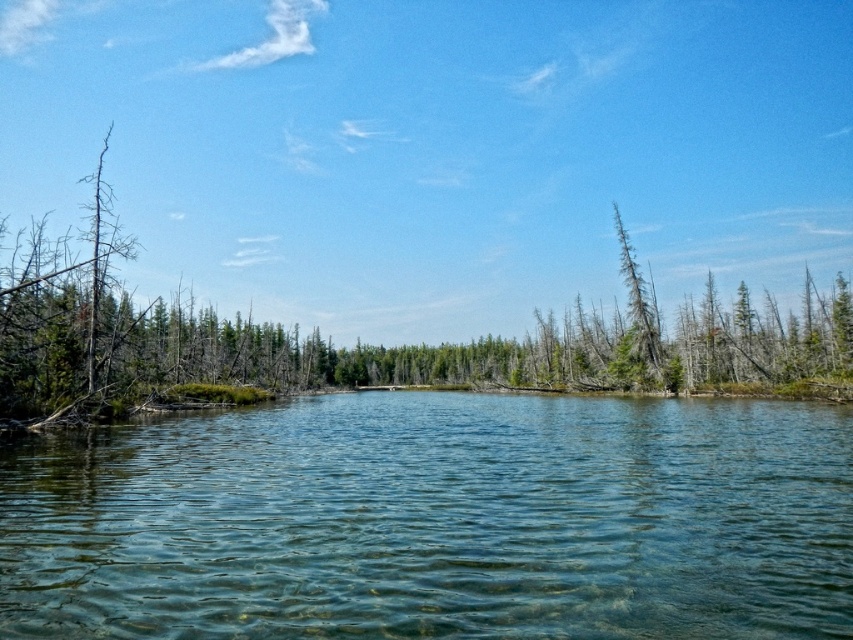
Is clear water at center to the right of green textured tree at center-right from the viewer's perspective?

In fact, clear water at center is to the left of green textured tree at center-right.

Is clear water at center above green textured tree at center-right?

No.

Locate an element on the screen. This screenshot has width=853, height=640. clear water at center is located at coordinates (436, 520).

How distant is clear water at center from green matte tree at center?

A distance of 45.09 meters exists between clear water at center and green matte tree at center.

Does point (439, 404) come in front of point (849, 346)?

No, (439, 404) is behind (849, 346).

Find the location of a particular element. The height and width of the screenshot is (640, 853). clear water at center is located at coordinates (436, 520).

How far apart are green matte tree at center and green textured tree at center-right?

They are 172.33 feet apart.

Is green matte tree at center to the left of green textured tree at center-right from the viewer's perspective?

Yes, green matte tree at center is to the left of green textured tree at center-right.

At what (x,y) coordinates should I click in order to perform the action: click on green matte tree at center. Please return your answer as a coordinate pair (x, y). Looking at the image, I should click on (241, 342).